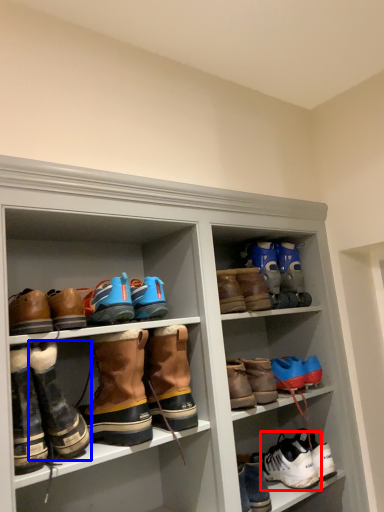
Question: Among these objects, which one is farthest to the camera, footwear (highlighted by a red box) or footwear (highlighted by a blue box)?

Choices:
 (A) footwear
 (B) footwear

Answer: (A)